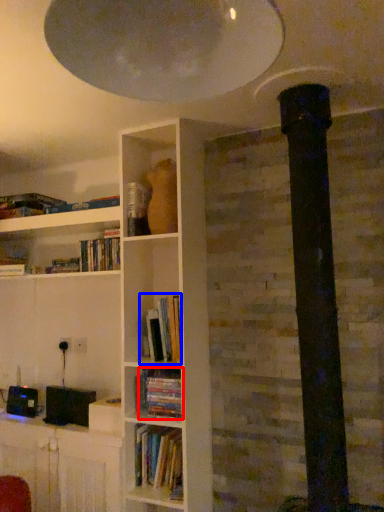
Question: Which object appears closest to the camera in this image, book (highlighted by a red box) or book (highlighted by a blue box)?

Choices:
 (A) book
 (B) book

Answer: (A)